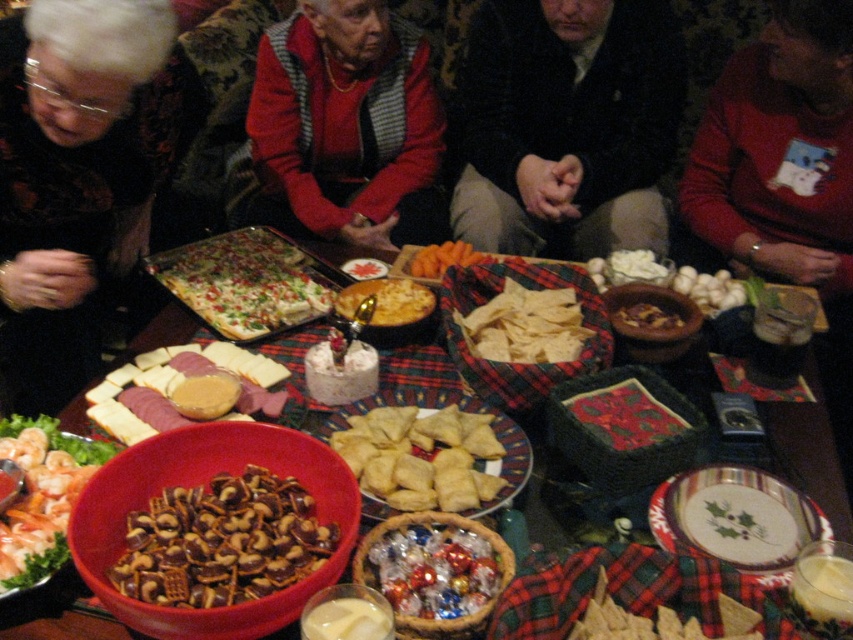
You are a guest at the festive gathering and want to choose a snack that is taller. Which one should you pick between the savory pretzels at center and the brown crumbly cake at center?

The savory pretzels at center has a greater height compared to the brown crumbly cake at center, so you should pick the savory pretzels at center.

You are standing at the edge of the table and want to reach the point marked at coordinates (41,497). What food item is located at that point?

The point at coordinates (41,497) is on the savory pretzels at center.

You are a guest at the festive gathering and want to reach for the golden brown crispy pastry at center and the light brown crispy chips at center. Which one is closer to you?

The golden brown crispy pastry at center is closer to you because it is shorter than the light brown crispy chips at center.